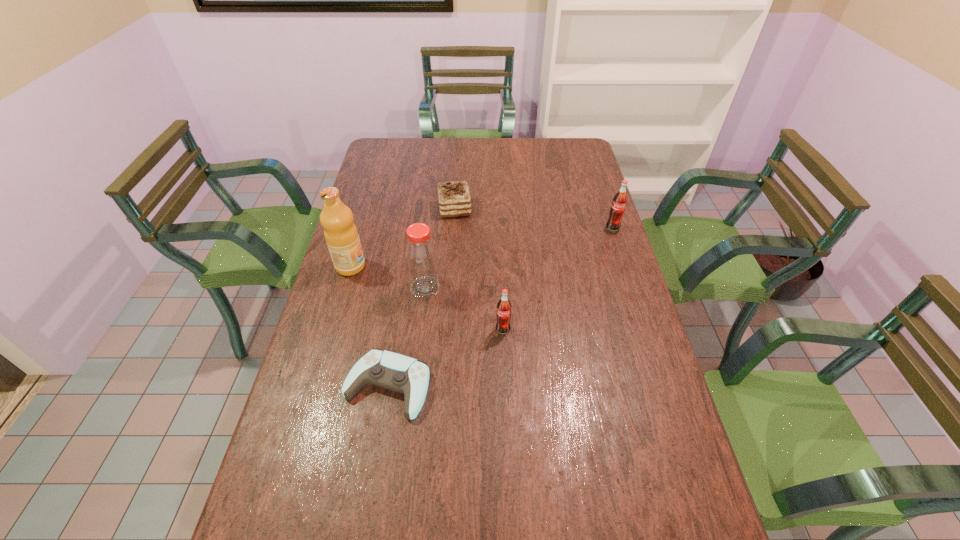
This screenshot has width=960, height=540. Find the location of `empty space between the nearer soda bottle and the right soda bottle`. empty space between the nearer soda bottle and the right soda bottle is located at coordinates (558, 279).

I want to click on free space between the bottle and the control, so click(x=406, y=337).

Identify the location of free space between the bottle and the fifth farthest object. (464, 308).

This screenshot has width=960, height=540. Identify the location of object that ranks as the fifth closest to the control. (617, 209).

Find the location of `object that is the fifth closest one to the right soda bottle`. object that is the fifth closest one to the right soda bottle is located at coordinates (341, 235).

Locate an element on the screen. vacant space that satisfies the following two spatial constraints: 1. on the front label of the leftmost object; 2. on the right side of the shortest object is located at coordinates (316, 386).

Find the location of `free space that satisfies the following two spatial constraints: 1. on the front label of the bottle; 2. on the right side of the fruit juice`. free space that satisfies the following two spatial constraints: 1. on the front label of the bottle; 2. on the right side of the fruit juice is located at coordinates (345, 288).

Image resolution: width=960 pixels, height=540 pixels. What are the coordinates of `free spot that satisfies the following two spatial constraints: 1. on the front label of the bottle; 2. on the right side of the leftmost object` in the screenshot? It's located at (345, 288).

Find the location of a particular element. blank area in the image that satisfies the following two spatial constraints: 1. on the label of the fourth shortest object; 2. on the front label of the fruit juice is located at coordinates (625, 266).